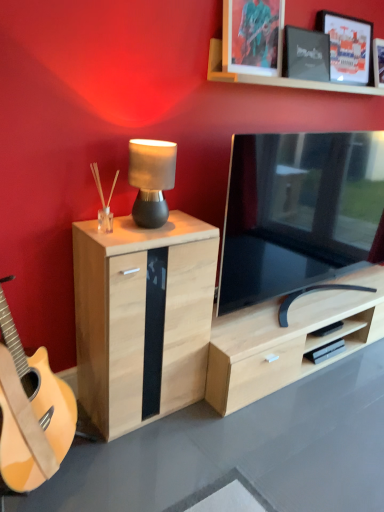
At what (x,y) coordinates should I click in order to perform the action: click on vacant space in front of natural wood cabinet at left. Please return your answer as a coordinate pair (x, y). This screenshot has height=512, width=384. Looking at the image, I should click on (171, 460).